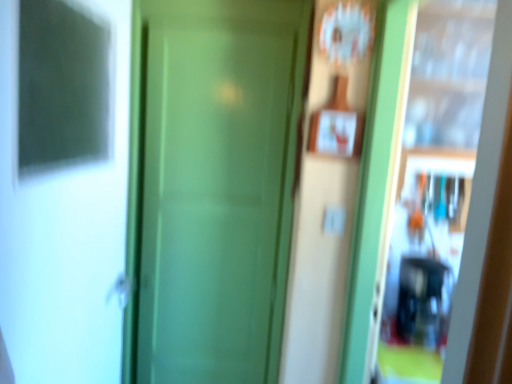
Question: Is white glossy screen door at left, the 1th screen door in the left-to-right sequence, located outside green matte screen door at center, the 2th screen door when ordered from left to right?

Choices:
 (A) yes
 (B) no

Answer: (A)

Question: Considering the relative positions of white glossy screen door at left, positioned as the 2th screen door in right-to-left order, and green matte screen door at center, the 2th screen door when ordered from left to right, in the image provided, is white glossy screen door at left, positioned as the 2th screen door in right-to-left order, in front of green matte screen door at center, the 2th screen door when ordered from left to right,?

Choices:
 (A) yes
 (B) no

Answer: (A)

Question: Considering the relative sizes of white glossy screen door at left, the 1th screen door in the left-to-right sequence, and green matte screen door at center, the 2th screen door when ordered from left to right, in the image provided, is white glossy screen door at left, the 1th screen door in the left-to-right sequence, smaller than green matte screen door at center, the 2th screen door when ordered from left to right,?

Choices:
 (A) no
 (B) yes

Answer: (B)

Question: Is green matte screen door at center, the 2th screen door when ordered from left to right, at the back of white glossy screen door at left, the 1th screen door in the left-to-right sequence?

Choices:
 (A) no
 (B) yes

Answer: (A)

Question: Does white glossy screen door at left, positioned as the 2th screen door in right-to-left order, have a greater width compared to green matte screen door at center, the 2th screen door when ordered from left to right?

Choices:
 (A) no
 (B) yes

Answer: (A)

Question: Is white glossy screen door at left, positioned as the 2th screen door in right-to-left order, further to the viewer compared to green matte screen door at center, positioned as the 1th screen door in right-to-left order?

Choices:
 (A) yes
 (B) no

Answer: (B)

Question: Is green matte screen door at center, the 2th screen door when ordered from left to right, turned away from white glossy screen door at left, positioned as the 2th screen door in right-to-left order?

Choices:
 (A) no
 (B) yes

Answer: (B)

Question: Is white glossy screen door at left, positioned as the 2th screen door in right-to-left order, a part of green matte screen door at center, positioned as the 1th screen door in right-to-left order?

Choices:
 (A) yes
 (B) no

Answer: (B)

Question: From the image's perspective, is green matte screen door at center, positioned as the 1th screen door in right-to-left order, under white glossy screen door at left, the 1th screen door in the left-to-right sequence?

Choices:
 (A) no
 (B) yes

Answer: (B)

Question: Is the position of green matte screen door at center, the 2th screen door when ordered from left to right, more distant than that of white glossy screen door at left, the 1th screen door in the left-to-right sequence?

Choices:
 (A) yes
 (B) no

Answer: (A)

Question: Does green matte screen door at center, the 2th screen door when ordered from left to right, turn towards white glossy screen door at left, the 1th screen door in the left-to-right sequence?

Choices:
 (A) no
 (B) yes

Answer: (B)

Question: Does green matte screen door at center, the 2th screen door when ordered from left to right, have a lesser width compared to white glossy screen door at left, the 1th screen door in the left-to-right sequence?

Choices:
 (A) no
 (B) yes

Answer: (A)

Question: Considering the relative sizes of green matte door at center and white glossy screen door at left, positioned as the 2th screen door in right-to-left order, in the image provided, is green matte door at center thinner than white glossy screen door at left, positioned as the 2th screen door in right-to-left order,?

Choices:
 (A) no
 (B) yes

Answer: (B)